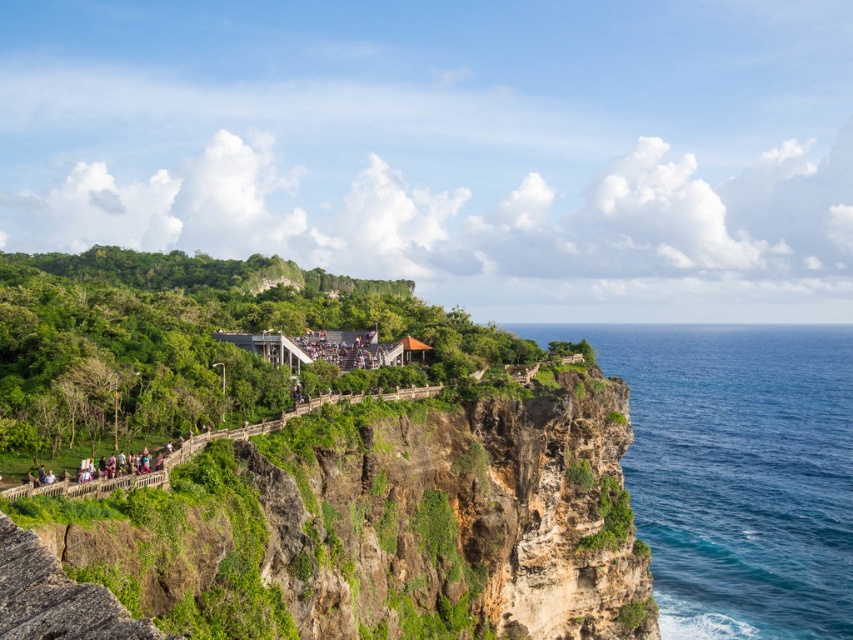
Is point (314, 442) positioned before point (795, 429)?

Yes, it is.

Does point (631, 541) come behind point (844, 512)?

No, it is in front of (844, 512).

Find the location of `green leafy hillside at center`. green leafy hillside at center is located at coordinates (357, 529).